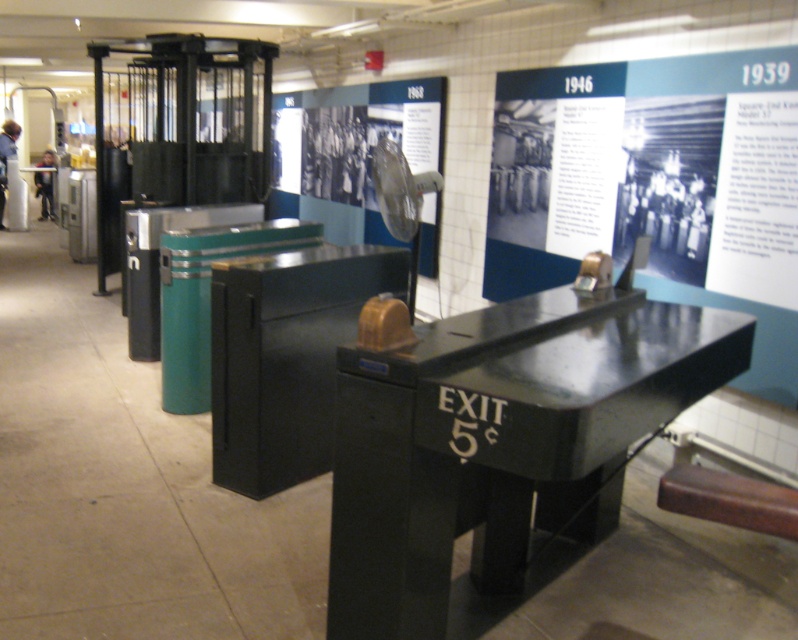
You are an event planner setting up a display table for a history exhibition. You have a white paper that needs to be placed on the black polished wood table at center. Considering the size of the white paper at upper center and the table, will the white paper fit on the table without overhanging the edges?

The black polished wood table at center is wider than the white paper at upper center, so the white paper will fit on the table without overhanging the edges.

You are a visitor in the museum and want to place a small souvenir on the closest surface to you. Which object between the black polished wood table at center and the white paper at upper center should you choose?

The black polished wood table at center is closer to the viewer than the white paper at upper center, so you should place the souvenir on the black polished wood table at center.